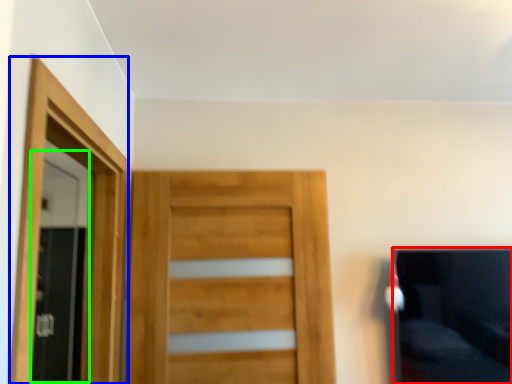
Question: Which is farther away from couch (highlighted by a red box)? screen door (highlighted by a blue box) or screen door (highlighted by a green box)?

Choices:
 (A) screen door
 (B) screen door

Answer: (B)